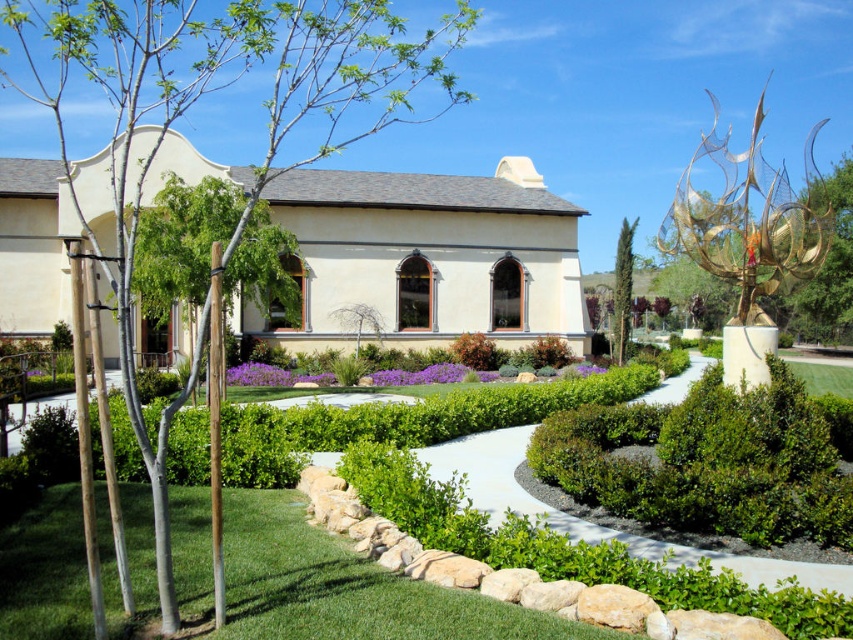
You are planning to place a 2m wide bench between the green leafy hedge at center and the green textured cypress at center. Which side of the bench should be closer to the narrower hedge to ensure there is enough space?

The green leafy hedge at center is narrower than the green textured cypress at center. To ensure enough space, the narrower side of the bench should be placed closer to the green leafy hedge at center.

You are standing at point (196, 99) in the garden. What object is located exactly at your current position?

At point (196, 99) lies green leafy tree at left.

You are standing at the entrance of the building and see two points in the garden. The first point is located at coordinates point (x=258, y=609) and the second at point (x=688, y=484). Which point is closer to you?

Point (x=258, y=609) is closer to the camera than point (x=688, y=484), so the first point is closer to you.